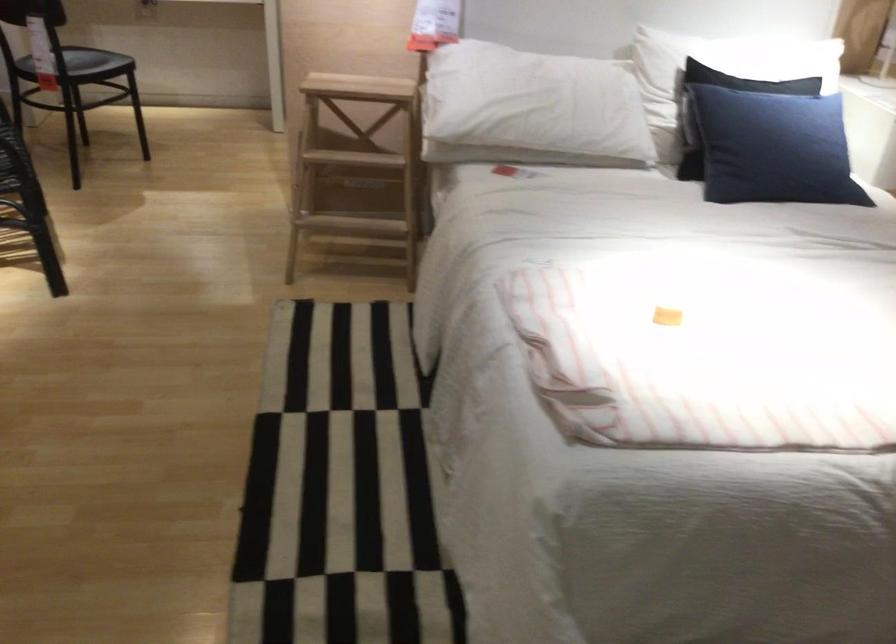
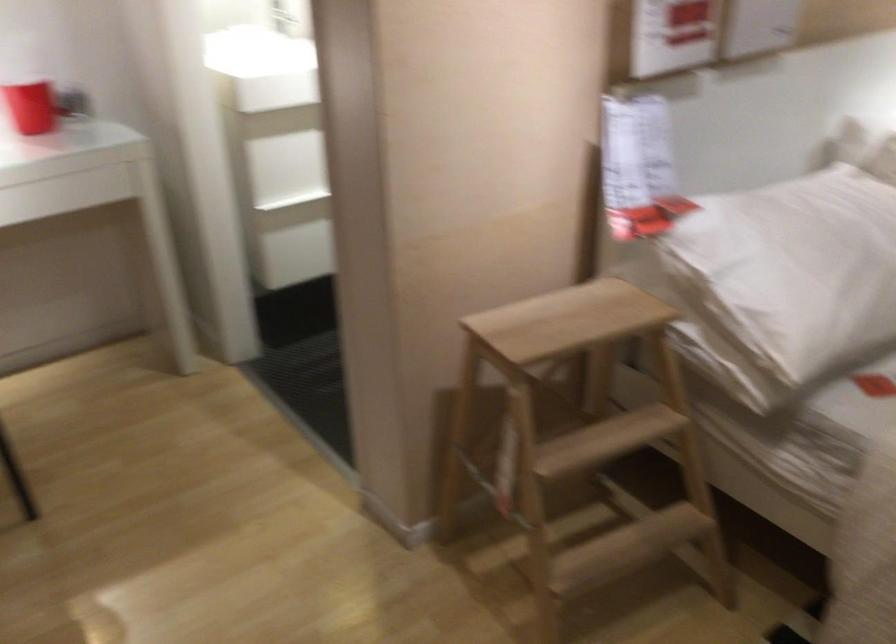
In the second image, find the point that corresponds to (x=357, y=154) in the first image.

(582, 436)